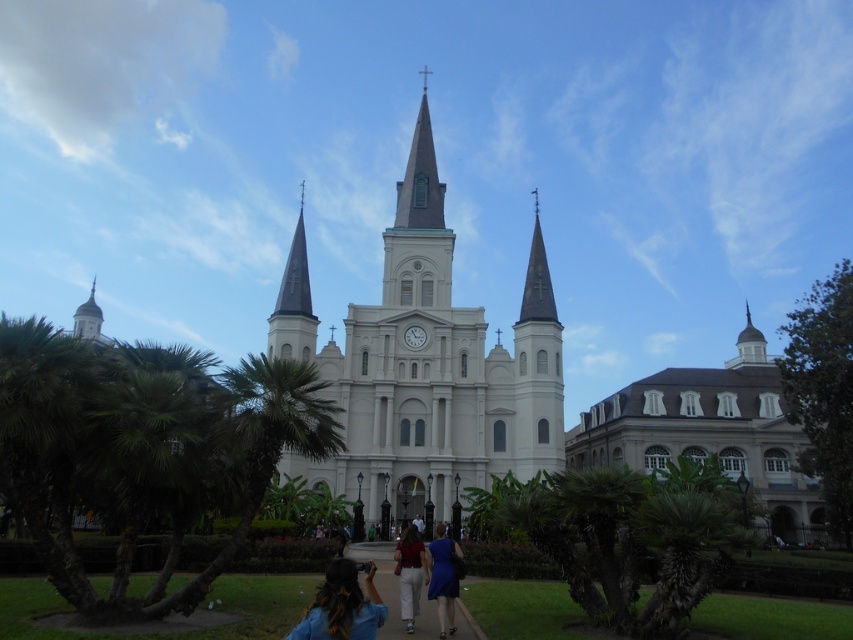
From the picture: You are standing in front of the cathedral and want to determine which of the two points, point (346, 628) or point (407, 620), is nearer to you. Based on the scene, which point is closer?

Point (346, 628) is closer to the viewer than point (407, 620).

You are standing in front of the cathedral and want to take a photo of the white smooth building at right and the white cotton pants at center. Which object is located to the right of the other?

The white smooth building at right is positioned on the right side of the white cotton pants at center.